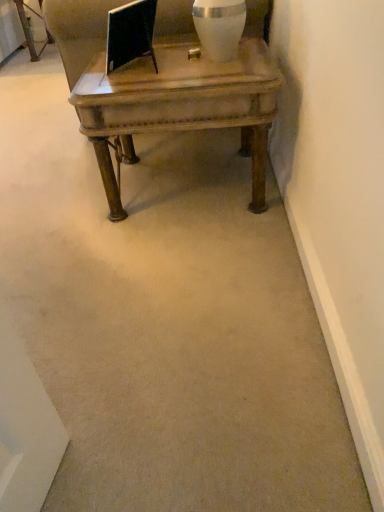
Question: Is white glossy vase at upper center at the right side of wooden coffee table at center?

Choices:
 (A) no
 (B) yes

Answer: (B)

Question: Could you tell me if white glossy vase at upper center is turned towards wooden coffee table at center?

Choices:
 (A) yes
 (B) no

Answer: (B)

Question: From the image's perspective, is white glossy vase at upper center on top of wooden coffee table at center?

Choices:
 (A) yes
 (B) no

Answer: (A)

Question: Can you confirm if white glossy vase at upper center is taller than wooden coffee table at center?

Choices:
 (A) yes
 (B) no

Answer: (B)

Question: Is the position of white glossy vase at upper center less distant than that of wooden coffee table at center?

Choices:
 (A) no
 (B) yes

Answer: (A)

Question: Is white glossy vase at upper center far away from wooden coffee table at center?

Choices:
 (A) no
 (B) yes

Answer: (A)

Question: From the image's perspective, is wooden coffee table at center on white glossy vase at upper center?

Choices:
 (A) yes
 (B) no

Answer: (B)

Question: Does wooden coffee table at center have a smaller size compared to white glossy vase at upper center?

Choices:
 (A) no
 (B) yes

Answer: (A)

Question: Is wooden coffee table at center at the left side of white glossy vase at upper center?

Choices:
 (A) no
 (B) yes

Answer: (B)

Question: Is wooden coffee table at center next to white glossy vase at upper center?

Choices:
 (A) yes
 (B) no

Answer: (B)

Question: Is there a large distance between wooden coffee table at center and white glossy vase at upper center?

Choices:
 (A) yes
 (B) no

Answer: (B)

Question: From a real-world perspective, is wooden coffee table at center located higher than white glossy vase at upper center?

Choices:
 (A) no
 (B) yes

Answer: (A)

Question: In terms of height, does wooden coffee table at center look taller or shorter compared to white glossy vase at upper center?

Choices:
 (A) tall
 (B) short

Answer: (A)